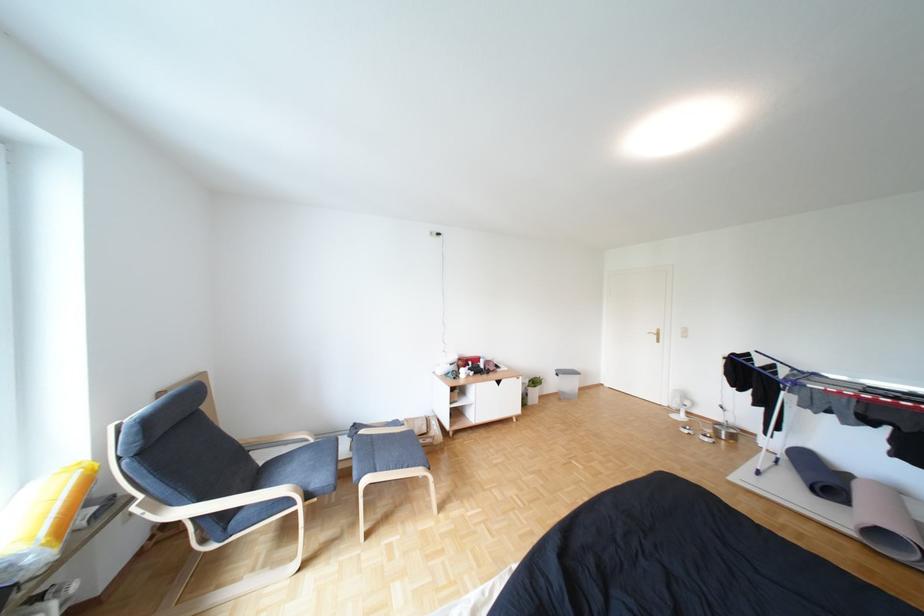
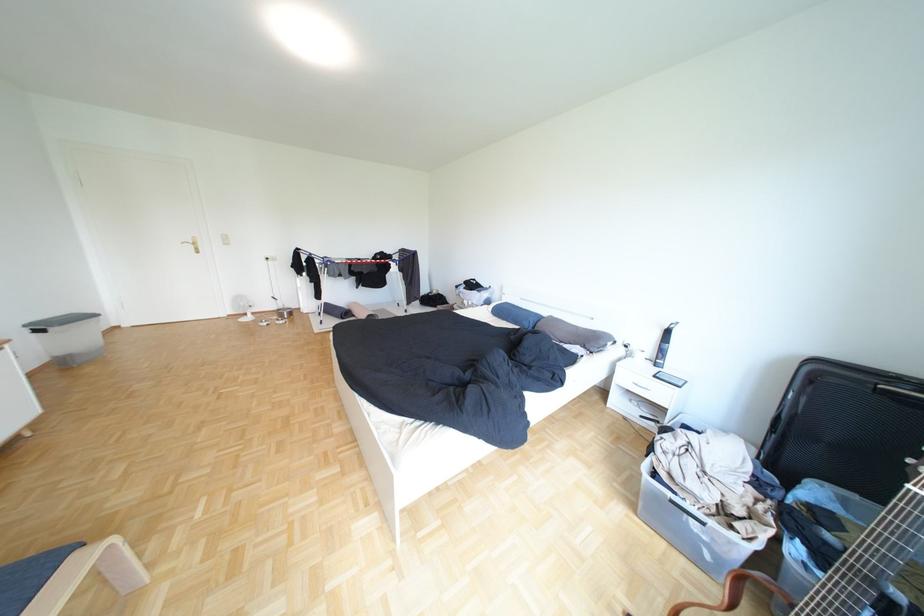
The point at (573, 375) is marked in the first image. Where is the corresponding point in the second image?

(55, 331)